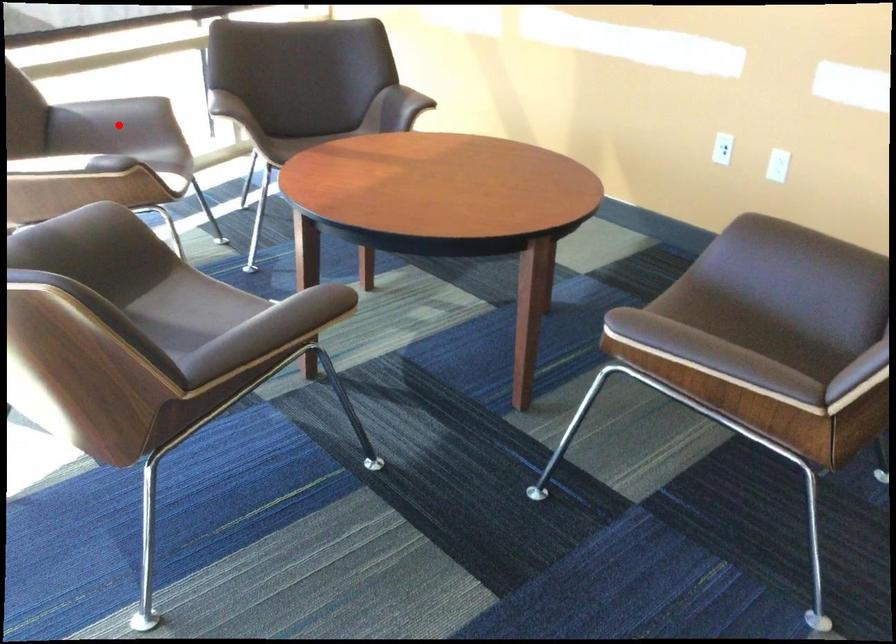
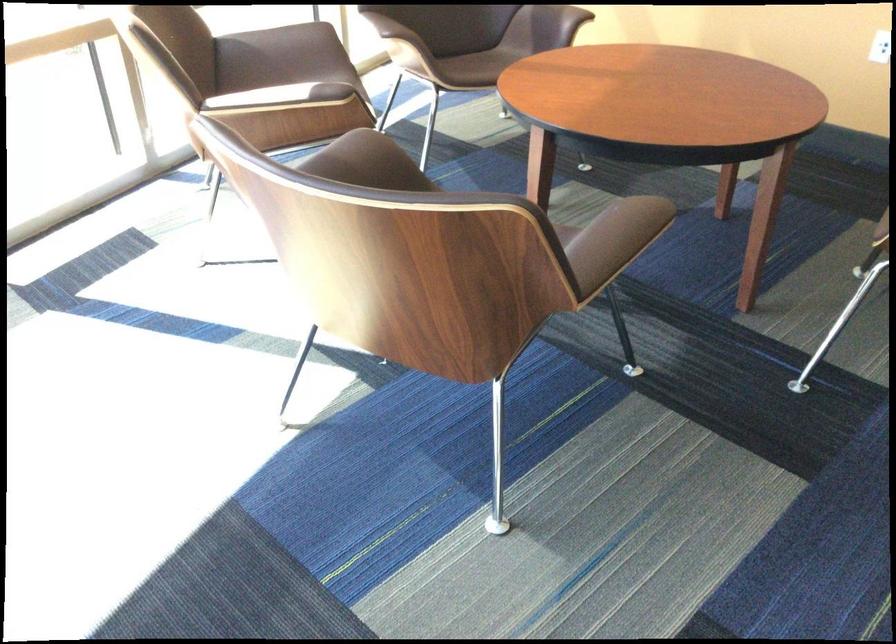
The point at the highlighted location is marked in the first image. Where is the corresponding point in the second image?

(281, 55)